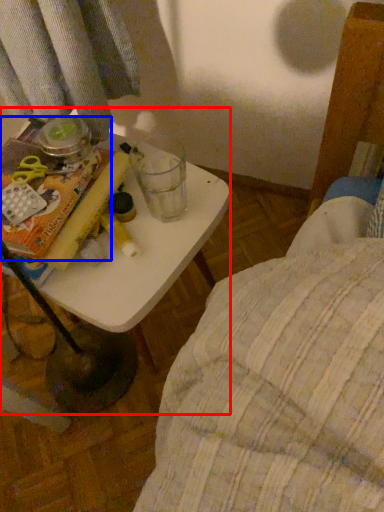
Question: Which object appears farthest to the camera in this image, table (highlighted by a red box) or paperback book (highlighted by a blue box)?

Choices:
 (A) table
 (B) paperback book

Answer: (A)